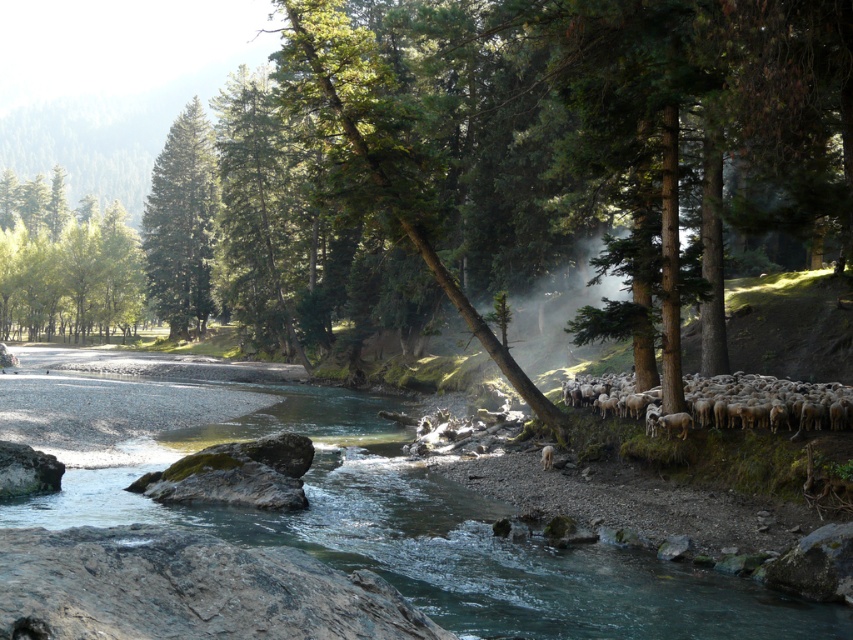
Question: In this image, where is clear water at river right located relative to white woolly sheep at right?

Choices:
 (A) below
 (B) above

Answer: (A)

Question: Is clear water at river right positioned in front of white woolly sheep at right?

Choices:
 (A) yes
 (B) no

Answer: (A)

Question: Which point is closer to the camera taking this photo?

Choices:
 (A) (634, 412)
 (B) (190, 524)
 (C) (25, 184)
 (D) (167, 204)

Answer: (B)

Question: Which of these objects is positioned closest to the green leafy tree at upper left?

Choices:
 (A) white woolly sheep at right
 (B) clear water at river right
 (C) green matte tree at upper left

Answer: (C)

Question: Which point is farther to the camera?

Choices:
 (A) (706, 392)
 (B) (102, 244)
 (C) (149, 241)

Answer: (C)

Question: From the image, what is the correct spatial relationship of green matte tree at upper left in relation to white woolly sheep at right?

Choices:
 (A) above
 (B) below

Answer: (A)